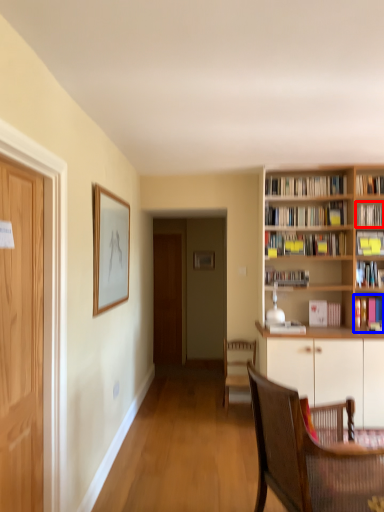
Question: Which point is closer to the camera, book (highlighted by a red box) or book (highlighted by a blue box)?

Choices:
 (A) book
 (B) book

Answer: (B)